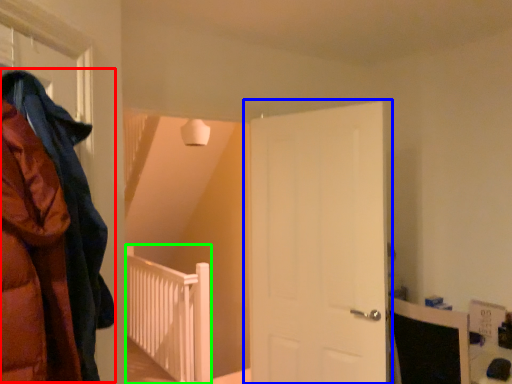
Question: Estimate the real-world distances between objects in this image. Which object is closer to cloak (highlighted by a red box), door (highlighted by a blue box) or rail (highlighted by a green box)?

Choices:
 (A) door
 (B) rail

Answer: (A)